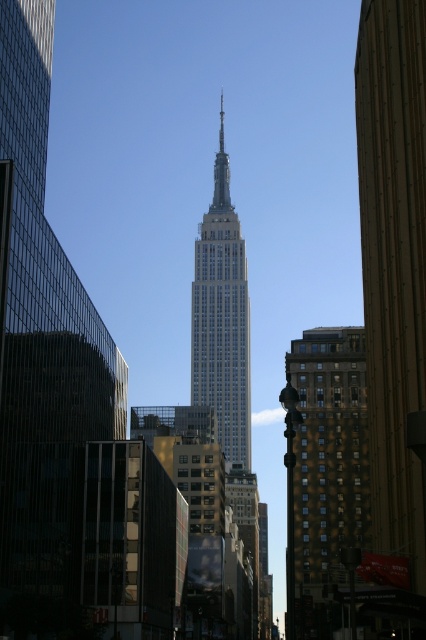
Question: Which of these objects is positioned farthest from the brown brick building at right?

Choices:
 (A) white glass building at center
 (B) polished steel spire at center

Answer: (B)

Question: Can you confirm if brown brick building at right is positioned to the right of white glass building at center?

Choices:
 (A) yes
 (B) no

Answer: (A)

Question: Does white glass building at center have a lesser width compared to polished steel spire at center?

Choices:
 (A) yes
 (B) no

Answer: (B)

Question: Which point is farther to the camera?

Choices:
 (A) (222, 156)
 (B) (313, 372)
 (C) (213, 312)

Answer: (A)

Question: Which object appears closest to the camera in this image?

Choices:
 (A) polished steel spire at center
 (B) white glass building at center

Answer: (B)

Question: Is the position of brown brick building at right more distant than that of polished steel spire at center?

Choices:
 (A) no
 (B) yes

Answer: (A)